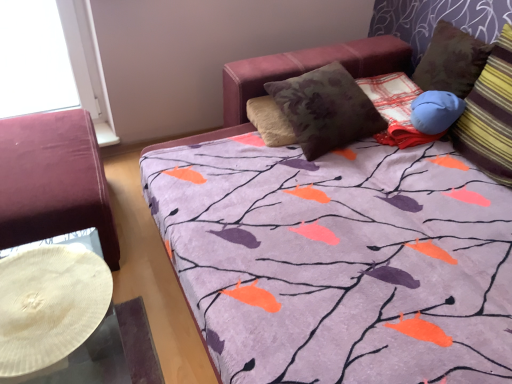
Locate an element on the screen. Image resolution: width=512 pixels, height=384 pixels. velvet burgundy ottoman at left is located at coordinates (53, 181).

What do you see at coordinates (53, 181) in the screenshot?
I see `velvet burgundy ottoman at left` at bounding box center [53, 181].

What is the approximate height of striped fabric pillow at right?

striped fabric pillow at right is 17.20 inches tall.

This screenshot has width=512, height=384. Describe the element at coordinates (489, 115) in the screenshot. I see `striped fabric pillow at right` at that location.

Where is `striped fabric pillow at right`? striped fabric pillow at right is located at coordinates (489, 115).

In order to face striped fabric pillow at right, should I rotate leftwards or rightwards?

To face it directly, rotate right by 32.065 degrees.

What are the coordinates of `velvet burgundy ottoman at left` in the screenshot? It's located at (53, 181).

Considering the positions of objects striped fabric pillow at right and velvet burgundy ottoman at left in the image provided, who is more to the left, striped fabric pillow at right or velvet burgundy ottoman at left?

From the viewer's perspective, velvet burgundy ottoman at left appears more on the left side.

Which is behind, striped fabric pillow at right or velvet burgundy ottoman at left?

velvet burgundy ottoman at left.

Does point (508, 35) appear closer or farther from the camera than point (64, 124)?

Point (508, 35) is positioned closer to the camera compared to point (64, 124).

From the image's perspective, is striped fabric pillow at right positioned above or below velvet burgundy ottoman at left?

Clearly, from the image's perspective, striped fabric pillow at right is above velvet burgundy ottoman at left.

From a real-world perspective, does striped fabric pillow at right sit lower than velvet burgundy ottoman at left?

No, from a real-world perspective, striped fabric pillow at right is not under velvet burgundy ottoman at left.

Considering the sizes of objects striped fabric pillow at right and velvet burgundy ottoman at left in the image provided, who is wider, striped fabric pillow at right or velvet burgundy ottoman at left?

velvet burgundy ottoman at left is wider.

Considering the sizes of striped fabric pillow at right and velvet burgundy ottoman at left in the image, is striped fabric pillow at right taller or shorter than velvet burgundy ottoman at left?

Considering their sizes, striped fabric pillow at right has more height than velvet burgundy ottoman at left.

Which of these two, striped fabric pillow at right or velvet burgundy ottoman at left, is bigger?

velvet burgundy ottoman at left.

Can we say striped fabric pillow at right lies outside velvet burgundy ottoman at left?

striped fabric pillow at right is positioned outside velvet burgundy ottoman at left.

Are striped fabric pillow at right and velvet burgundy ottoman at left located far from each other?

Yes, striped fabric pillow at right is far from velvet burgundy ottoman at left.

Is striped fabric pillow at right facing towards velvet burgundy ottoman at left?

No, striped fabric pillow at right is not facing towards velvet burgundy ottoman at left.

At what (x,y) coordinates should I click in order to perform the action: click on furniture below the striped fabric pillow at right (from the image's perspective). Please return your answer as a coordinate pair (x, y). The width and height of the screenshot is (512, 384). Looking at the image, I should click on (53, 181).

From the picture: Does velvet burgundy ottoman at left appear on the right side of striped fabric pillow at right?

No.

Which object is closer to the camera taking this photo, velvet burgundy ottoman at left or striped fabric pillow at right?

striped fabric pillow at right is more forward.

Is point (91, 159) positioned before point (484, 158)?

Yes, it is.

From the image's perspective, is velvet burgundy ottoman at left above striped fabric pillow at right?

No.

From a real-world perspective, is velvet burgundy ottoman at left located beneath striped fabric pillow at right?

Yes.

Is velvet burgundy ottoman at left thinner than striped fabric pillow at right?

In fact, velvet burgundy ottoman at left might be wider than striped fabric pillow at right.

Considering the relative sizes of velvet burgundy ottoman at left and striped fabric pillow at right in the image provided, is velvet burgundy ottoman at left shorter than striped fabric pillow at right?

Yes.

Who is bigger, velvet burgundy ottoman at left or striped fabric pillow at right?

Bigger between the two is velvet burgundy ottoman at left.

Would you say velvet burgundy ottoman at left is inside or outside striped fabric pillow at right?

velvet burgundy ottoman at left lies outside striped fabric pillow at right.

Is velvet burgundy ottoman at left directly adjacent to striped fabric pillow at right?

velvet burgundy ottoman at left is not next to striped fabric pillow at right, and they're not touching.

Could you tell me if velvet burgundy ottoman at left is facing striped fabric pillow at right?

No.

Can you tell me how much velvet burgundy ottoman at left and striped fabric pillow at right differ in facing direction?

The facing directions of velvet burgundy ottoman at left and striped fabric pillow at right are 88 degrees apart.

Find the location of a particular element. The image size is (512, 384). pillow lying above the velvet burgundy ottoman at left (from the image's perspective) is located at coordinates (489, 115).

Find the location of `furniture below the striped fabric pillow at right (from the image's perspective)`. furniture below the striped fabric pillow at right (from the image's perspective) is located at coordinates (53, 181).

Identify the location of furniture on the left of striped fabric pillow at right. The width and height of the screenshot is (512, 384). (53, 181).